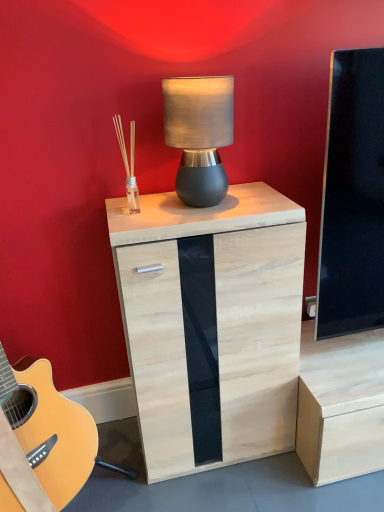
This screenshot has height=512, width=384. In order to click on vacant space situated above light wood/glass cabinet at center (from a real-world perspective) in this screenshot , I will do `click(201, 203)`.